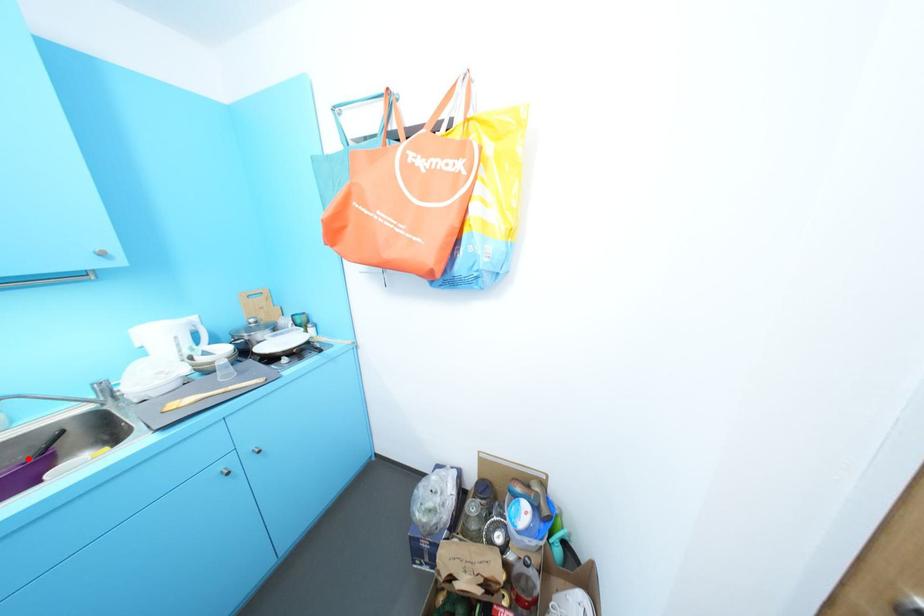
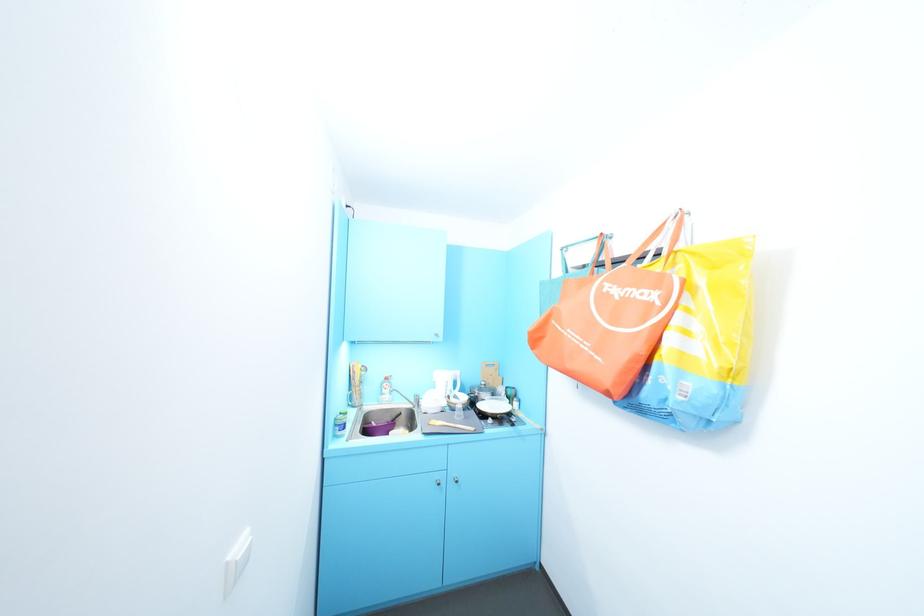
Locate, in the second image, the point that corresponds to the highlighted location in the first image.

(395, 419)